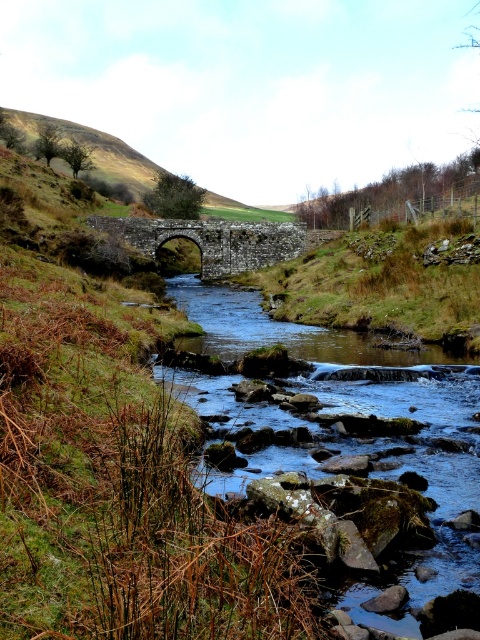
You are a hiker who wants to cross the river. You see the clear water at center and the stone arch bridge at center. Which one is higher from the ground level?

The clear water at center is much taller than the stone arch bridge at center, so the clear water at center is higher from the ground level.

You are a hiker who wants to cross the river using the stone arch bridge at center. However, you notice the clear water at center is flowing rapidly. Based on the scene, can you determine if the water is to the left or right of the bridge?

The clear water at center is positioned on the right side of the stone arch bridge at center, so the water is flowing to the right of the bridge.

You are a photographer planning to capture the entire scene in one shot. Given that the clear water at center and the stone arch bridge at center are both crucial elements, which one should you focus on to ensure both are visible and properly framed?

The clear water at center has a larger size compared to the stone arch bridge at center, so focusing on the larger clear water at center will help ensure both elements are properly framed within the shot.